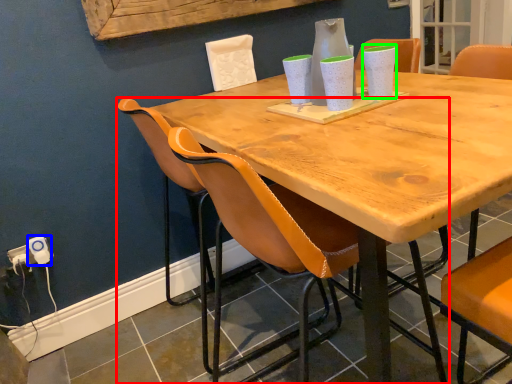
Question: Based on their relative distances, which object is farther from chair (highlighted by a red box)? Choose from electric outlet (highlighted by a blue box) and vase (highlighted by a green box).

Choices:
 (A) electric outlet
 (B) vase

Answer: (B)